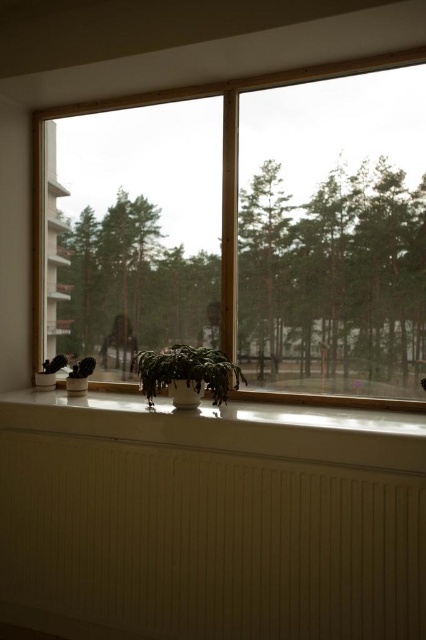
You are standing in the room and want to place a small decorative item on the windowsill. The windowsill is represented by the point at coordinates point (244, 230). Where exactly on the windowsill should you place the item to ensure it is centered?

The point (244, 230) represents the center of the matte white windowsill at center, so placing the item at this coordinate will center it.

You are a gardener who wants to place a new small potted herb on the windowsill. Given the current arrangement, can the matte white windowsill at center accommodate the green matte plant at center and the new herb without overcrowding?

The matte white windowsill at center is bigger than the green matte plant at center, so there should be enough space to add the new herb without overcrowding.

You are a plant enthusiast who wants to place a new potted plant on the windowsill. Which windowsill, the matte white windowsill at center or the white glossy window sill at lower center, has more space for your plant?

The matte white windowsill at center is bigger than the white glossy window sill at lower center, so it has more space for your plant.